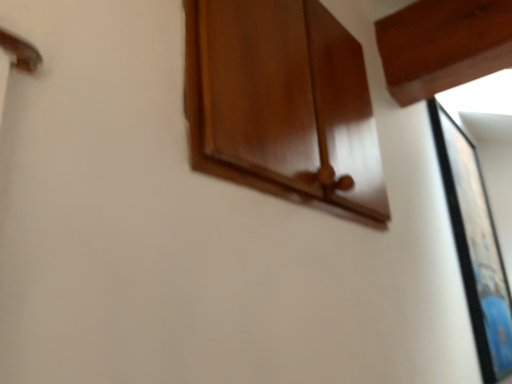
What do you see at coordinates (282, 102) in the screenshot?
I see `glossy wood cabinet at upper center` at bounding box center [282, 102].

In order to click on glossy wood cabinet at upper center in this screenshot , I will do `click(282, 102)`.

This screenshot has width=512, height=384. What do you see at coordinates (475, 245) in the screenshot?
I see `black glossy picture frame at right` at bounding box center [475, 245].

Where is `black glossy picture frame at right`? black glossy picture frame at right is located at coordinates (475, 245).

Where is `glossy wood cabinet at upper center`? The height and width of the screenshot is (384, 512). glossy wood cabinet at upper center is located at coordinates (282, 102).

Between glossy wood cabinet at upper center and black glossy picture frame at right, which one appears on the right side from the viewer's perspective?

From the viewer's perspective, black glossy picture frame at right appears more on the right side.

Which object is further away from the camera taking this photo, glossy wood cabinet at upper center or black glossy picture frame at right?

black glossy picture frame at right.

Is point (196, 109) positioned before point (499, 301)?

Yes, point (196, 109) is closer to viewer.

From the image's perspective, is glossy wood cabinet at upper center over black glossy picture frame at right?

Yes.

From a real-world perspective, is glossy wood cabinet at upper center below black glossy picture frame at right?

Actually, glossy wood cabinet at upper center is physically above black glossy picture frame at right in the real world.

Which of these two, glossy wood cabinet at upper center or black glossy picture frame at right, is thinner?

glossy wood cabinet at upper center is thinner.

Between glossy wood cabinet at upper center and black glossy picture frame at right, which one has less height?

Standing shorter between the two is glossy wood cabinet at upper center.

Is glossy wood cabinet at upper center smaller than black glossy picture frame at right?

Correct, glossy wood cabinet at upper center occupies less space than black glossy picture frame at right.

Does glossy wood cabinet at upper center contain black glossy picture frame at right?

No, black glossy picture frame at right is located outside of glossy wood cabinet at upper center.

Is the surface of glossy wood cabinet at upper center in direct contact with black glossy picture frame at right?

No, glossy wood cabinet at upper center is not with black glossy picture frame at right.

Is glossy wood cabinet at upper center aimed at black glossy picture frame at right?

No.

What's the angular difference between glossy wood cabinet at upper center and black glossy picture frame at right's facing directions?

2.01 degrees.

There is a black glossy picture frame at right. Where is `cabinetry above it (from a real-world perspective)`? cabinetry above it (from a real-world perspective) is located at coordinates (282, 102).

Can you confirm if black glossy picture frame at right is positioned to the right of glossy wood cabinet at upper center?

Yes.

Is black glossy picture frame at right closer to the viewer compared to glossy wood cabinet at upper center?

That is False.

Which point is more distant from viewer, (488, 225) or (223, 171)?

Positioned behind is point (488, 225).

From the image's perspective, which is below, black glossy picture frame at right or glossy wood cabinet at upper center?

black glossy picture frame at right, from the image's perspective.

From a real-world perspective, relative to glossy wood cabinet at upper center, is black glossy picture frame at right vertically above or below?

black glossy picture frame at right is below glossy wood cabinet at upper center.

Which object is thinner, black glossy picture frame at right or glossy wood cabinet at upper center?

glossy wood cabinet at upper center is thinner.

Between black glossy picture frame at right and glossy wood cabinet at upper center, which one has more height?

black glossy picture frame at right is taller.

Considering the relative sizes of black glossy picture frame at right and glossy wood cabinet at upper center in the image provided, is black glossy picture frame at right smaller than glossy wood cabinet at upper center?

Actually, black glossy picture frame at right might be larger than glossy wood cabinet at upper center.

Is black glossy picture frame at right not within glossy wood cabinet at upper center?

black glossy picture frame at right is positioned outside glossy wood cabinet at upper center.

Does black glossy picture frame at right touch glossy wood cabinet at upper center?

No, black glossy picture frame at right is not beside glossy wood cabinet at upper center.

Is black glossy picture frame at right oriented away from glossy wood cabinet at upper center?

No, glossy wood cabinet at upper center is not at the back of black glossy picture frame at right.

Locate an element on the screen. This screenshot has width=512, height=384. cabinetry that appears above the black glossy picture frame at right (from a real-world perspective) is located at coordinates (282, 102).

You are a GUI agent. You are given a task and a screenshot of the screen. Output one action in this format:
    pyautogui.click(x=<x>, y=<y>)
    Task: Click on the cabinetry on the left of black glossy picture frame at right
    
    Given the screenshot: What is the action you would take?
    pyautogui.click(x=282, y=102)

The image size is (512, 384). Identify the location of cabinetry above the black glossy picture frame at right (from the image's perspective). click(x=282, y=102).